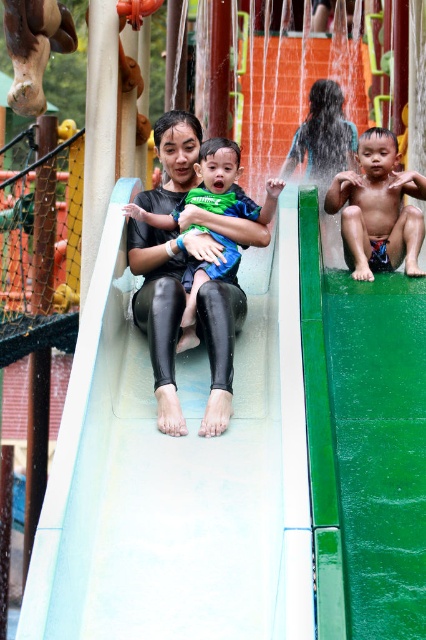
Based on the scene description, which object is positioned to the left of the other between the matte black swimwear at left and the matte black wetsuit at center?

The matte black swimwear at left is positioned to the left of the matte black wetsuit at center.

You are a photographer standing at the edge of the water park. You want to take a photo of the matte black swimwear at left and the matte black wetsuit at center. However, you need to ensure that both subjects are in focus. Given that your camera can only focus on objects within a 10 meter range, will you be able to capture both subjects clearly in the same photo?

The matte black swimwear at left is 15.86 meters away from the matte black wetsuit at center. Since the distance between them exceeds the camera focus range of 10 meters, you cannot capture both subjects clearly in the same photo.

You are a lifeguard at the water park. You see the skinny boy at center and the matte black swimwear at left. Which one is located to the right of the other?

The skinny boy at center is positioned on the right side of matte black swimwear at left.